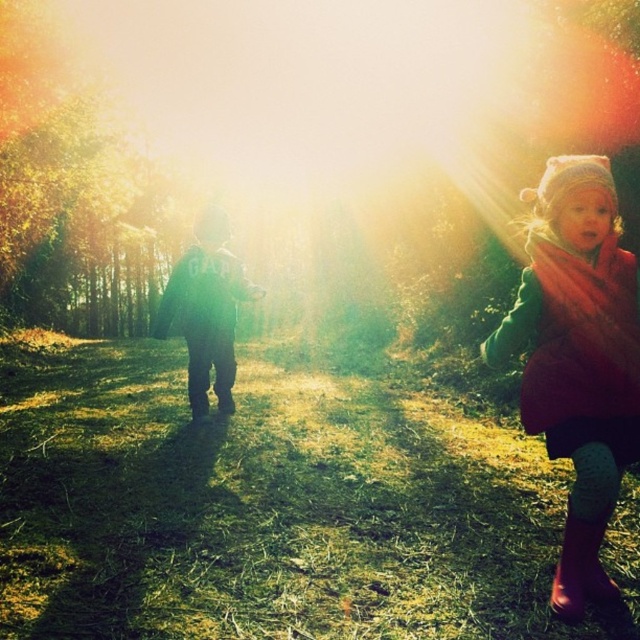
Question: Observing the image, what is the correct spatial positioning of knitted woolen hat at upper right in reference to rubber boots at lower right?

Choices:
 (A) left
 (B) right

Answer: (A)

Question: Can you confirm if knitted woolen hat at upper right is positioned to the left of rubber boots at lower right?

Choices:
 (A) yes
 (B) no

Answer: (A)

Question: Can you confirm if knitted woolen hat at upper right is positioned to the right of rubber boots at lower right?

Choices:
 (A) no
 (B) yes

Answer: (A)

Question: Which point is farther from the camera taking this photo?

Choices:
 (A) (605, 586)
 (B) (632, 320)

Answer: (A)